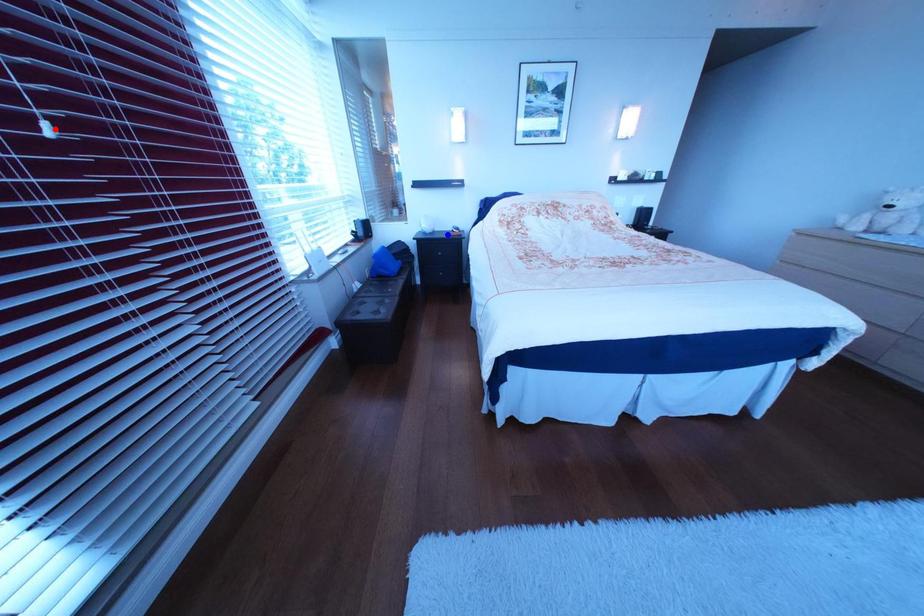
Question: Two points are marked on the image. Which point is closer to the camera?

Choices:
 (A) Blue point is closer.
 (B) Red point is closer.

Answer: (B)